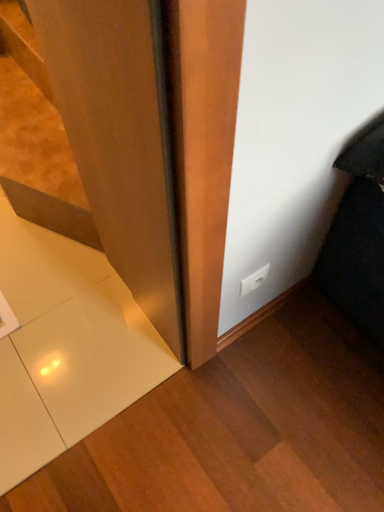
The height and width of the screenshot is (512, 384). Find the location of `white plastic power plug at lower right`. white plastic power plug at lower right is located at coordinates (254, 280).

What do you see at coordinates (254, 280) in the screenshot?
I see `white plastic power plug at lower right` at bounding box center [254, 280].

What are the coordinates of `white plastic power plug at lower right` in the screenshot? It's located at (254, 280).